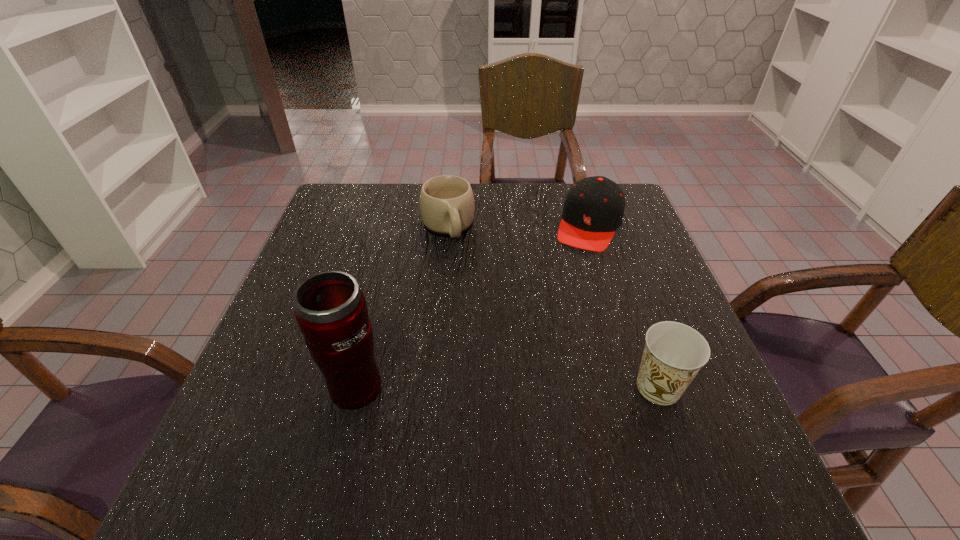
Identify the location of vacant region that satisfies the following two spatial constraints: 1. on the front side of the second object from left to right; 2. on the right side of the Dixie cup. The height and width of the screenshot is (540, 960). (433, 387).